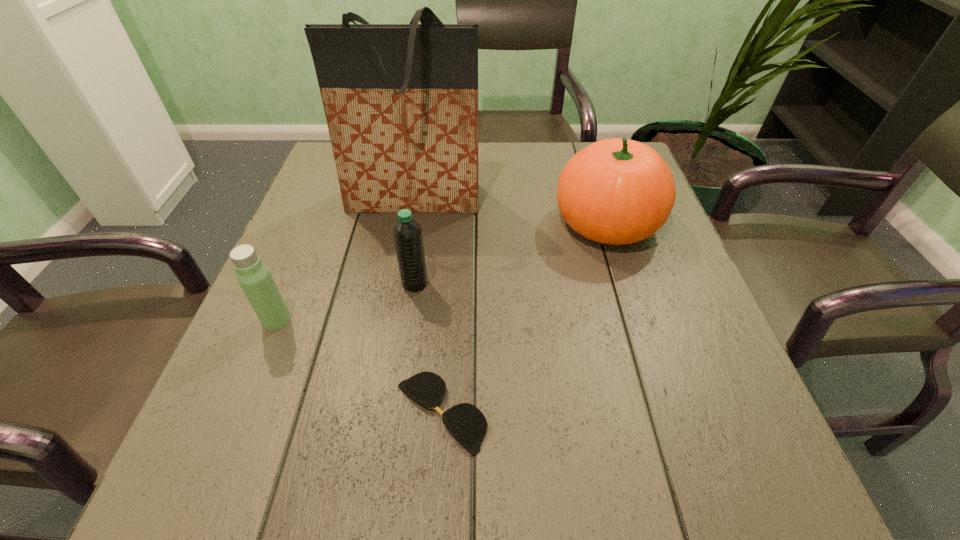
Image resolution: width=960 pixels, height=540 pixels. I want to click on shopping bag, so click(x=401, y=100).

Locate an element on the screen. pumpkin is located at coordinates (616, 191).

Where is `the rightmost object`? The width and height of the screenshot is (960, 540). the rightmost object is located at coordinates (616, 191).

Locate an element on the screen. Image resolution: width=960 pixels, height=540 pixels. the third nearest object is located at coordinates (407, 233).

Identify the location of the second nearest object. This screenshot has height=540, width=960. (254, 277).

Identify the location of the leftmost object. (254, 277).

The image size is (960, 540). I want to click on spectacles, so click(x=467, y=424).

Identify the location of the shortest object. Image resolution: width=960 pixels, height=540 pixels. tap(467, 424).

The image size is (960, 540). I want to click on free spot located 0.270m on the front-facing side of the shopping bag, so click(394, 316).

Find the location of a particular element. The width and height of the screenshot is (960, 540). vacant space located on the back of the second tallest object is located at coordinates (585, 152).